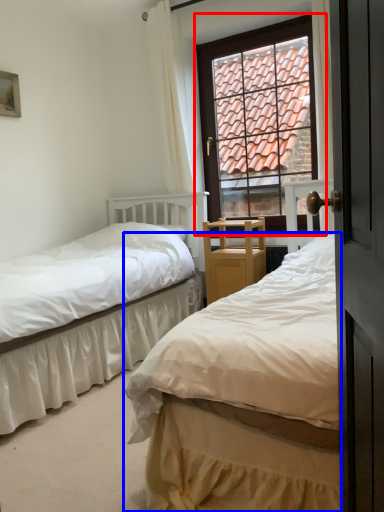
Question: Which point is further to the camera, window (highlighted by a red box) or bed (highlighted by a blue box)?

Choices:
 (A) window
 (B) bed

Answer: (A)